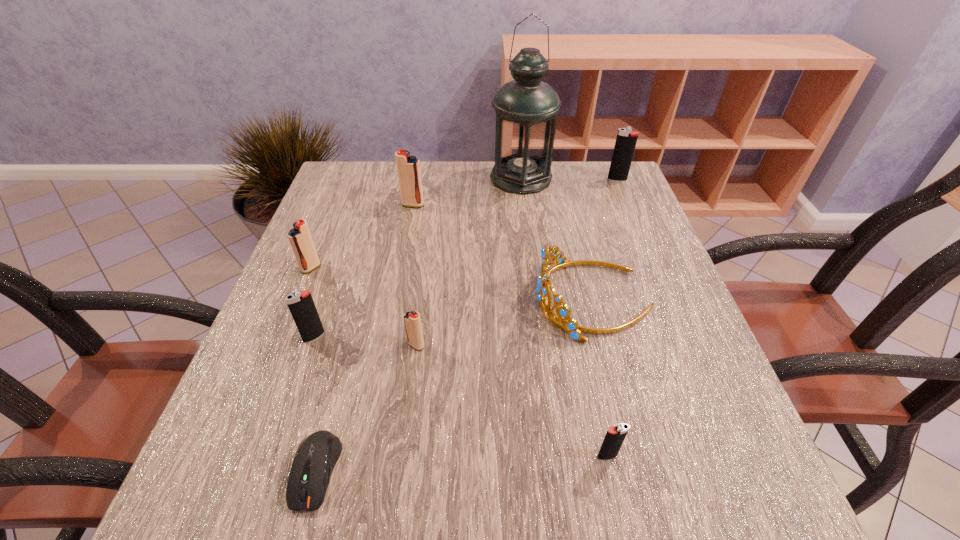
Where is `vacant region located on the front-facing side of the gold tiara`? This screenshot has height=540, width=960. vacant region located on the front-facing side of the gold tiara is located at coordinates (340, 299).

At what (x,y) coordinates should I click in order to perform the action: click on vacant space situated on the front-facing side of the gold tiara. Please return your answer as a coordinate pair (x, y). Image resolution: width=960 pixels, height=540 pixels. Looking at the image, I should click on (440, 299).

At what (x,y) coordinates should I click in order to perform the action: click on vacant space situated 0.350m on the front-facing side of the gold tiara. Please return your answer as a coordinate pair (x, y). Looking at the image, I should click on (360, 299).

Locate an element on the screen. vacant region located on the front of the leftmost black igniter is located at coordinates (298, 386).

Where is `vacant region located 0.330m on the front of the second smallest red igniter`? Image resolution: width=960 pixels, height=540 pixels. vacant region located 0.330m on the front of the second smallest red igniter is located at coordinates (251, 417).

Identify the location of free spot located 0.240m on the front of the smallest red igniter. Image resolution: width=960 pixels, height=540 pixels. (397, 490).

The width and height of the screenshot is (960, 540). Find the location of `free space located on the front of the nearest igniter`. free space located on the front of the nearest igniter is located at coordinates (615, 496).

In order to click on oil lamp that is at the far edge in this screenshot , I will do `click(526, 108)`.

Locate an element on the screen. object that is at the near edge is located at coordinates (314, 461).

The height and width of the screenshot is (540, 960). I want to click on computer equipment that is at the left edge, so click(314, 461).